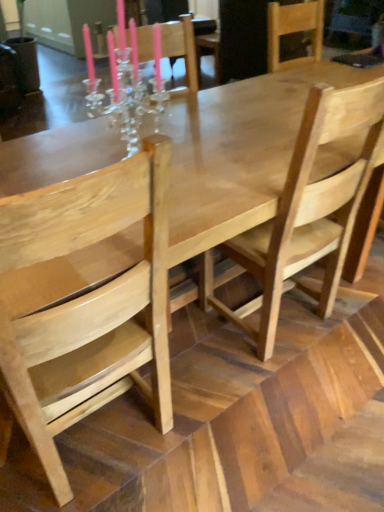
Where is `natural wood chair at left, which is the second chair from right to left`? natural wood chair at left, which is the second chair from right to left is located at coordinates (86, 306).

Describe the element at coordinates (86, 306) in the screenshot. I see `natural wood chair at left, which is the second chair from right to left` at that location.

How much space does light brown wood chair at center, which is counted as the second chair, starting from the left, occupy horizontally?

light brown wood chair at center, which is counted as the second chair, starting from the left, is 21.20 inches wide.

The image size is (384, 512). What are the coordinates of `light brown wood chair at center, which is counted as the second chair, starting from the left` in the screenshot? It's located at (309, 209).

This screenshot has width=384, height=512. What do you see at coordinates (309, 209) in the screenshot? I see `light brown wood chair at center, which is counted as the second chair, starting from the left` at bounding box center [309, 209].

The height and width of the screenshot is (512, 384). What are the coordinates of `natural wood chair at left, which is the 1th chair in left-to-right order` in the screenshot? It's located at (86, 306).

Considering the relative positions of light brown wood chair at center, which is counted as the second chair, starting from the left, and natural wood chair at left, which is the 1th chair in left-to-right order, in the image provided, is light brown wood chair at center, which is counted as the second chair, starting from the left, to the right of natural wood chair at left, which is the 1th chair in left-to-right order, from the viewer's perspective?

Yes, light brown wood chair at center, which is counted as the second chair, starting from the left, is to the right of natural wood chair at left, which is the 1th chair in left-to-right order.

Looking at this image, considering the relative positions of light brown wood chair at center, the 1th chair when ordered from right to left, and natural wood chair at left, which is the second chair from right to left, in the image provided, is light brown wood chair at center, the 1th chair when ordered from right to left, behind natural wood chair at left, which is the second chair from right to left,?

Yes, it is behind natural wood chair at left, which is the second chair from right to left.

Is point (367, 138) closer or farther from the camera than point (92, 200)?

Point (367, 138) is positioned farther from the camera compared to point (92, 200).

From the image's perspective, which one is positioned lower, light brown wood chair at center, the 1th chair when ordered from right to left, or natural wood chair at left, which is the 1th chair in left-to-right order?

From the image's view, natural wood chair at left, which is the 1th chair in left-to-right order, is below.

Consider the image. From a real-world perspective, which object rests below the other?

From a 3D spatial view, natural wood chair at left, which is the 1th chair in left-to-right order, is below.

Considering the sizes of light brown wood chair at center, which is counted as the second chair, starting from the left, and natural wood chair at left, which is the 1th chair in left-to-right order, in the image, is light brown wood chair at center, which is counted as the second chair, starting from the left, wider or thinner than natural wood chair at left, which is the 1th chair in left-to-right order,?

Considering their sizes, light brown wood chair at center, which is counted as the second chair, starting from the left, looks slimmer than natural wood chair at left, which is the 1th chair in left-to-right order.

Does light brown wood chair at center, which is counted as the second chair, starting from the left, have a greater height compared to natural wood chair at left, which is the 1th chair in left-to-right order?

Correct, light brown wood chair at center, which is counted as the second chair, starting from the left, is much taller as natural wood chair at left, which is the 1th chair in left-to-right order.

In the scene shown: Who is smaller, light brown wood chair at center, which is counted as the second chair, starting from the left, or natural wood chair at left, which is the 1th chair in left-to-right order?

Smaller between the two is light brown wood chair at center, which is counted as the second chair, starting from the left.

Is light brown wood chair at center, the 1th chair when ordered from right to left, not within natural wood chair at left, which is the 1th chair in left-to-right order?

light brown wood chair at center, the 1th chair when ordered from right to left, is positioned outside natural wood chair at left, which is the 1th chair in left-to-right order.

Is light brown wood chair at center, which is counted as the second chair, starting from the left, far away from natural wood chair at left, which is the 1th chair in left-to-right order?

No.

Is light brown wood chair at center, which is counted as the second chair, starting from the left, turned away from natural wood chair at left, which is the 1th chair in left-to-right order?

No, light brown wood chair at center, which is counted as the second chair, starting from the left, is not facing the opposite direction of natural wood chair at left, which is the 1th chair in left-to-right order.

Can you tell me how much light brown wood chair at center, the 1th chair when ordered from right to left, and natural wood chair at left, which is the 1th chair in left-to-right order, differ in facing direction?

The facing directions of light brown wood chair at center, the 1th chair when ordered from right to left, and natural wood chair at left, which is the 1th chair in left-to-right order, are 0.000202 degrees apart.

You are a GUI agent. You are given a task and a screenshot of the screen. Output one action in this format:
    pyautogui.click(x=<x>, y=<y>)
    Task: Click on the chair directly beneath the light brown wood chair at center, the 1th chair when ordered from right to left (from a real-world perspective)
    
    Given the screenshot: What is the action you would take?
    pyautogui.click(x=86, y=306)

Which is more to the left, natural wood chair at left, which is the 1th chair in left-to-right order, or light brown wood chair at center, the 1th chair when ordered from right to left?

natural wood chair at left, which is the 1th chair in left-to-right order.

Looking at this image, is the depth of natural wood chair at left, which is the second chair from right to left, greater than that of light brown wood chair at center, which is counted as the second chair, starting from the left?

No, natural wood chair at left, which is the second chair from right to left, is closer to the viewer.

Is point (138, 164) less distant than point (270, 348)?

Yes, it is.

From the image's perspective, is natural wood chair at left, which is the 1th chair in left-to-right order, under light brown wood chair at center, the 1th chair when ordered from right to left?

Correct, natural wood chair at left, which is the 1th chair in left-to-right order, appears lower than light brown wood chair at center, the 1th chair when ordered from right to left, in the image.

From a real-world perspective, is natural wood chair at left, which is the 1th chair in left-to-right order, positioned over light brown wood chair at center, the 1th chair when ordered from right to left, based on gravity?

No, from a real-world perspective, natural wood chair at left, which is the 1th chair in left-to-right order, is not on top of light brown wood chair at center, the 1th chair when ordered from right to left.

Does natural wood chair at left, which is the second chair from right to left, have a greater width compared to light brown wood chair at center, which is counted as the second chair, starting from the left?

Indeed, natural wood chair at left, which is the second chair from right to left, has a greater width compared to light brown wood chair at center, which is counted as the second chair, starting from the left.

Between natural wood chair at left, which is the second chair from right to left, and light brown wood chair at center, which is counted as the second chair, starting from the left, which one has more height?

light brown wood chair at center, which is counted as the second chair, starting from the left, is taller.

Based on the photo, does natural wood chair at left, which is the 1th chair in left-to-right order, have a smaller size compared to light brown wood chair at center, which is counted as the second chair, starting from the left?

Actually, natural wood chair at left, which is the 1th chair in left-to-right order, might be larger than light brown wood chair at center, which is counted as the second chair, starting from the left.

Would you say natural wood chair at left, which is the second chair from right to left, is inside or outside light brown wood chair at center, the 1th chair when ordered from right to left?

natural wood chair at left, which is the second chair from right to left, is spatially situated outside light brown wood chair at center, the 1th chair when ordered from right to left.

Are natural wood chair at left, which is the second chair from right to left, and light brown wood chair at center, the 1th chair when ordered from right to left, beside each other?

No, natural wood chair at left, which is the second chair from right to left, is not next to light brown wood chair at center, the 1th chair when ordered from right to left.

Is natural wood chair at left, which is the 1th chair in left-to-right order, oriented away from light brown wood chair at center, which is counted as the second chair, starting from the left?

No, natural wood chair at left, which is the 1th chair in left-to-right order,'s orientation is not away from light brown wood chair at center, which is counted as the second chair, starting from the left.

How different are the orientations of natural wood chair at left, which is the 1th chair in left-to-right order, and light brown wood chair at center, the 1th chair when ordered from right to left, in degrees?

natural wood chair at left, which is the 1th chair in left-to-right order, and light brown wood chair at center, the 1th chair when ordered from right to left, are facing 0.000202 degrees away from each other.

Measure the distance between natural wood chair at left, which is the 1th chair in left-to-right order, and light brown wood chair at center, which is counted as the second chair, starting from the left.

They are 24.74 inches apart.

What are the coordinates of `chair above the natural wood chair at left, which is the 1th chair in left-to-right order (from a real-world perspective)` in the screenshot? It's located at (309, 209).

The height and width of the screenshot is (512, 384). I want to click on chair that is on the left side of light brown wood chair at center, the 1th chair when ordered from right to left, so click(86, 306).

At what (x,y) coordinates should I click in order to perform the action: click on chair that is below the light brown wood chair at center, which is counted as the second chair, starting from the left (from the image's perspective). Please return your answer as a coordinate pair (x, y). This screenshot has height=512, width=384. Looking at the image, I should click on (86, 306).